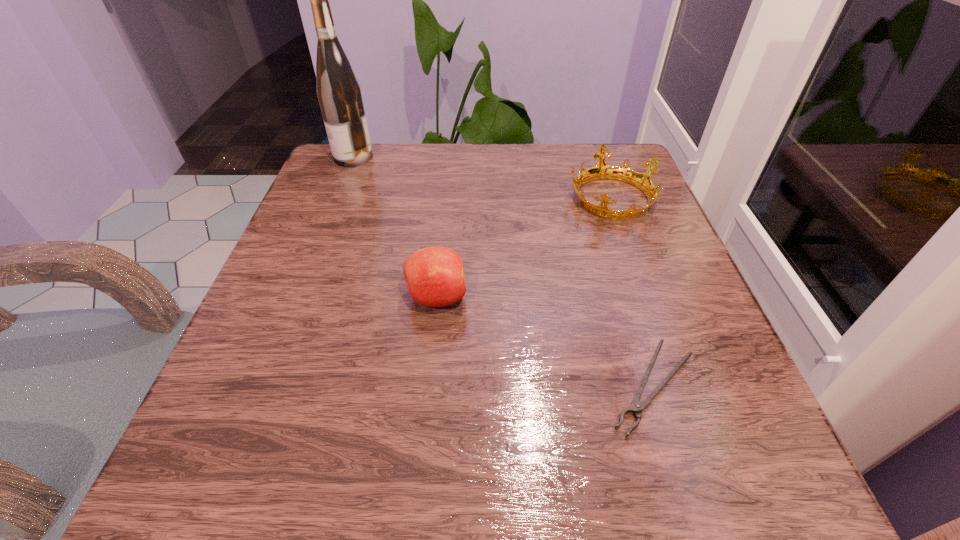
At what (x,y) coordinates should I click in order to perform the action: click on the farthest object. Please return your answer as a coordinate pair (x, y). Image resolution: width=960 pixels, height=540 pixels. Looking at the image, I should click on click(x=338, y=91).

Image resolution: width=960 pixels, height=540 pixels. What are the coordinates of `wine bottle` in the screenshot? It's located at (338, 91).

The image size is (960, 540). I want to click on the third shortest object, so click(435, 276).

The height and width of the screenshot is (540, 960). Identify the location of the third farthest object. (435, 276).

This screenshot has height=540, width=960. I want to click on the second farthest object, so click(x=642, y=181).

The width and height of the screenshot is (960, 540). I want to click on crown, so click(x=642, y=181).

Identify the location of the shortest object. The height and width of the screenshot is (540, 960). (637, 406).

Find the location of a particular element. This screenshot has width=960, height=540. tongs is located at coordinates (637, 406).

You are a GUI agent. You are given a task and a screenshot of the screen. Output one action in this format:
    pyautogui.click(x=<x>, y=<y>)
    Task: Click on the blank space located 0.360m on the right of the leftmost object
    
    Given the screenshot: What is the action you would take?
    pyautogui.click(x=518, y=157)

Where is `free space located 0.050m on the front of the apple`? free space located 0.050m on the front of the apple is located at coordinates (432, 345).